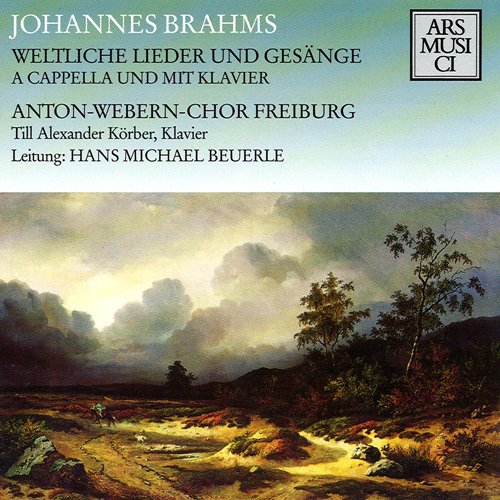
Where is `painting`? This screenshot has height=500, width=500. painting is located at coordinates (185, 344).